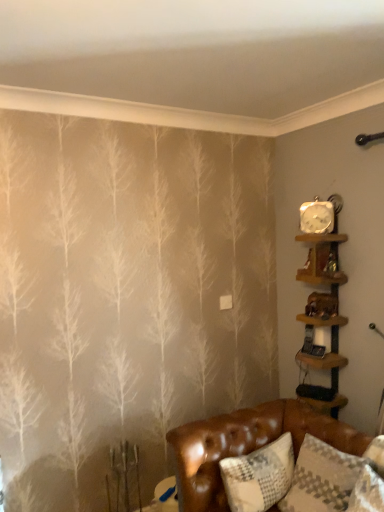
Question: Is brown leather couch at lower right positioned far away from wooden shelf at upper right, which is counted as the 1th shelf, starting from the top?

Choices:
 (A) yes
 (B) no

Answer: (B)

Question: Does brown leather couch at lower right have a larger size compared to wooden shelf at upper right, which is counted as the 1th shelf, starting from the top?

Choices:
 (A) yes
 (B) no

Answer: (A)

Question: Is brown leather couch at lower right positioned before wooden shelf at upper right, which is counted as the 1th shelf, starting from the top?

Choices:
 (A) no
 (B) yes

Answer: (B)

Question: From a real-world perspective, is brown leather couch at lower right below wooden shelf at upper right, which is counted as the 1th shelf, starting from the top?

Choices:
 (A) yes
 (B) no

Answer: (A)

Question: Considering the relative sizes of brown leather couch at lower right and wooden shelf at upper right, which is counted as the 1th shelf, starting from the top, in the image provided, is brown leather couch at lower right taller than wooden shelf at upper right, which is counted as the 1th shelf, starting from the top,?

Choices:
 (A) no
 (B) yes

Answer: (B)

Question: Does brown leather couch at lower right have a greater width compared to wooden shelf at upper right, marked as the 2th shelf in a bottom-to-top arrangement?

Choices:
 (A) yes
 (B) no

Answer: (A)

Question: Does metallic silver clock at upper right have a larger size compared to white textured pillow at lower right?

Choices:
 (A) no
 (B) yes

Answer: (A)

Question: Is metallic silver clock at upper right next to white textured pillow at lower right and touching it?

Choices:
 (A) no
 (B) yes

Answer: (A)

Question: Can you confirm if metallic silver clock at upper right is taller than white textured pillow at lower right?

Choices:
 (A) yes
 (B) no

Answer: (B)

Question: Could white textured pillow at lower right be considered to be inside metallic silver clock at upper right?

Choices:
 (A) no
 (B) yes

Answer: (A)

Question: Does metallic silver clock at upper right come behind white textured pillow at lower right?

Choices:
 (A) yes
 (B) no

Answer: (A)

Question: From a real-world perspective, is metallic silver clock at upper right positioned over white textured pillow at lower right based on gravity?

Choices:
 (A) no
 (B) yes

Answer: (B)

Question: Is wooden shelf at upper right, which is counted as the 1th shelf, starting from the top, at the back of white textured pillow at lower right?

Choices:
 (A) no
 (B) yes

Answer: (A)